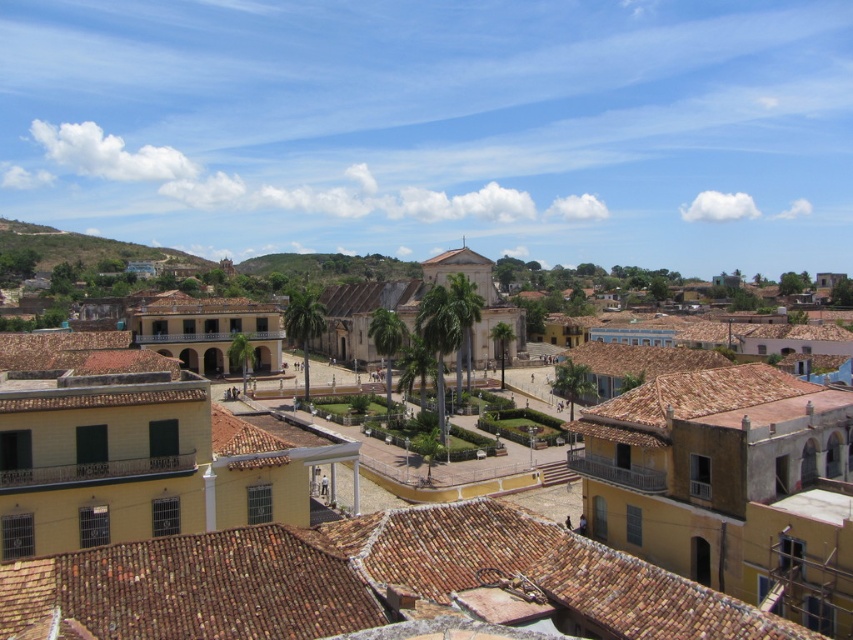
Question: Among these points, which one is nearest to the camera?

Choices:
 (A) (268, 536)
 (B) (67, 248)

Answer: (A)

Question: Is brown tile roof at lower center to the left of green grassy hillside at upper left from the viewer's perspective?

Choices:
 (A) no
 (B) yes

Answer: (A)

Question: Can you confirm if yellow clay roof tiles at center is positioned to the left of green grassy hillside at upper left?

Choices:
 (A) no
 (B) yes

Answer: (A)

Question: Which object is closer to the camera taking this photo?

Choices:
 (A) brown tile roof at lower center
 (B) green grassy hillside at upper left

Answer: (A)

Question: Which object is the farthest from the green grassy hillside at upper left?

Choices:
 (A) brown tile roof at lower center
 (B) yellow clay roof tiles at center

Answer: (A)

Question: Is the position of yellow clay roof tiles at center less distant than that of brown tile roof at lower center?

Choices:
 (A) yes
 (B) no

Answer: (B)